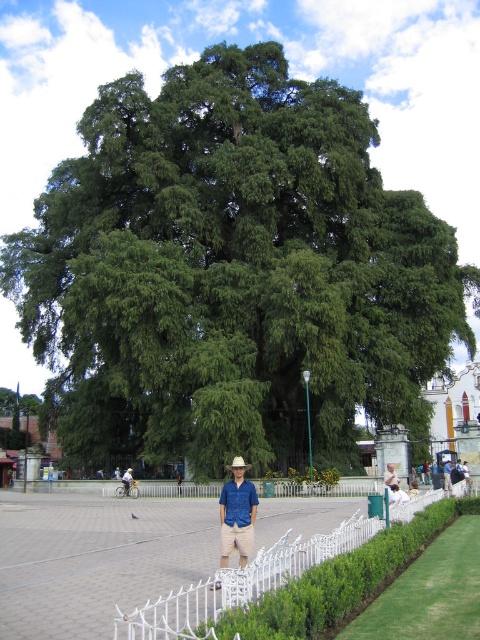
You are a photographer trying to capture the blue cotton shirt at center and the blue denim shirt at center in a single frame. Which shirt is covering the other one in the image?

The blue cotton shirt at center is positioned over the blue denim shirt at center, so it is covering the denim one.

You are a photographer trying to capture both the blue fabric shirt at center and the blue denim shirt at center in a single frame. Based on their positions and sizes, which shirt should you focus on to ensure both are clearly visible in the photo?

The blue fabric shirt at center might be wider than blue denim shirt at center, so focusing on the blue fabric shirt at center would help ensure both shirts are visible in the frame.

You are a photographer trying to capture both the blue fabric shirt at center and the blue denim shirt at center in a single frame. Which shirt should you focus on first to ensure both are clearly visible in the photo?

The blue fabric shirt at center is larger in size than the blue denim shirt at center, so you should focus on the blue fabric shirt at center first to ensure both are clearly visible in the photo.